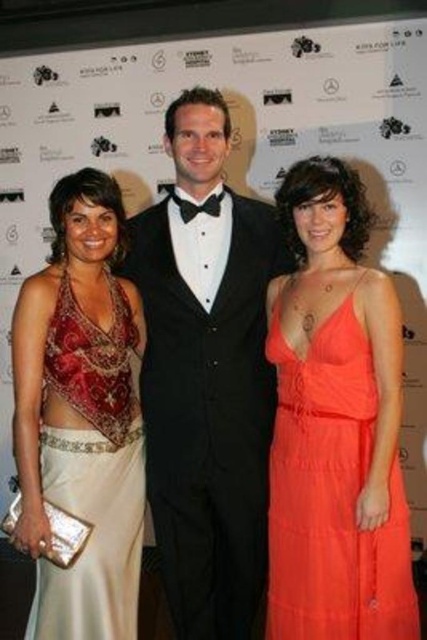
Between orange chiffon dress at center and satin gold dress at left, which one appears on the left side from the viewer's perspective?

Positioned to the left is satin gold dress at left.

Does orange chiffon dress at center have a lesser width compared to satin gold dress at left?

Incorrect, orange chiffon dress at center's width is not less than satin gold dress at left's.

This screenshot has width=427, height=640. In order to click on orange chiffon dress at center in this screenshot , I will do `click(336, 426)`.

Identify the location of orange chiffon dress at center. (336, 426).

Can you confirm if black satin tuxedo at center is smaller than satin gold dress at left?

No, black satin tuxedo at center is not smaller than satin gold dress at left.

Is point (242, 620) positioned behind point (108, 484)?

Yes, it is.

The image size is (427, 640). In order to click on black satin tuxedo at center in this screenshot , I will do `click(207, 374)`.

Who is positioned more to the left, black satin tuxedo at center or orange chiffon dress at center?

black satin tuxedo at center

What do you see at coordinates (207, 374) in the screenshot?
I see `black satin tuxedo at center` at bounding box center [207, 374].

Locate an element on the screen. This screenshot has width=427, height=640. black satin tuxedo at center is located at coordinates (207, 374).

This screenshot has height=640, width=427. Find the location of `black satin tuxedo at center`. black satin tuxedo at center is located at coordinates (207, 374).